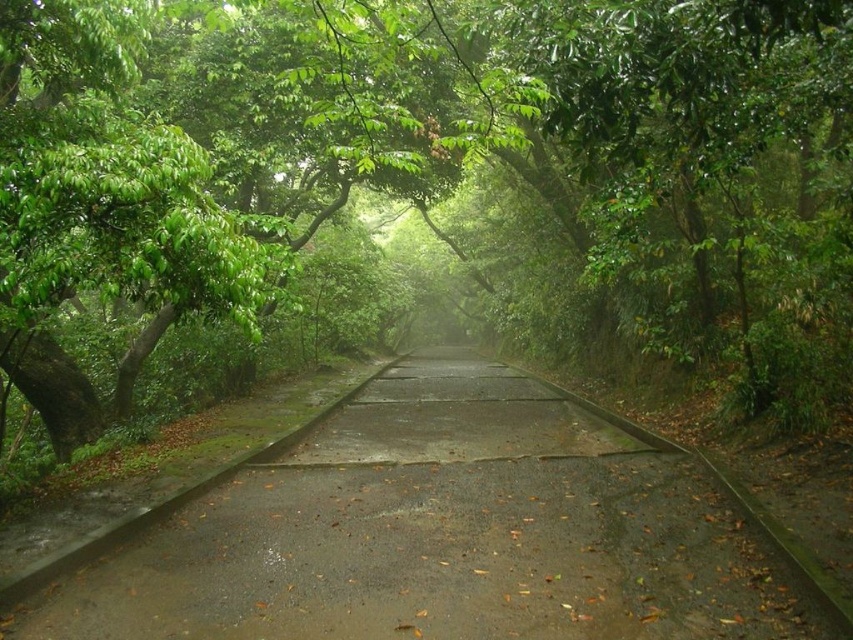
Question: Is green leafy tree at center bigger than concrete road at center?

Choices:
 (A) no
 (B) yes

Answer: (B)

Question: Is green leafy tree at center above concrete road at center?

Choices:
 (A) yes
 (B) no

Answer: (A)

Question: Is green leafy tree at center further to the viewer compared to concrete road at center?

Choices:
 (A) no
 (B) yes

Answer: (A)